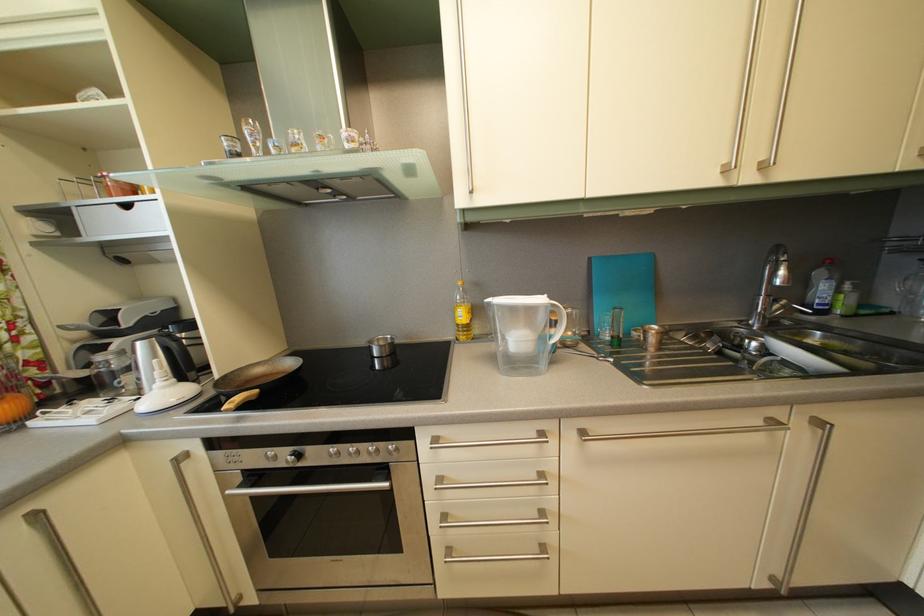
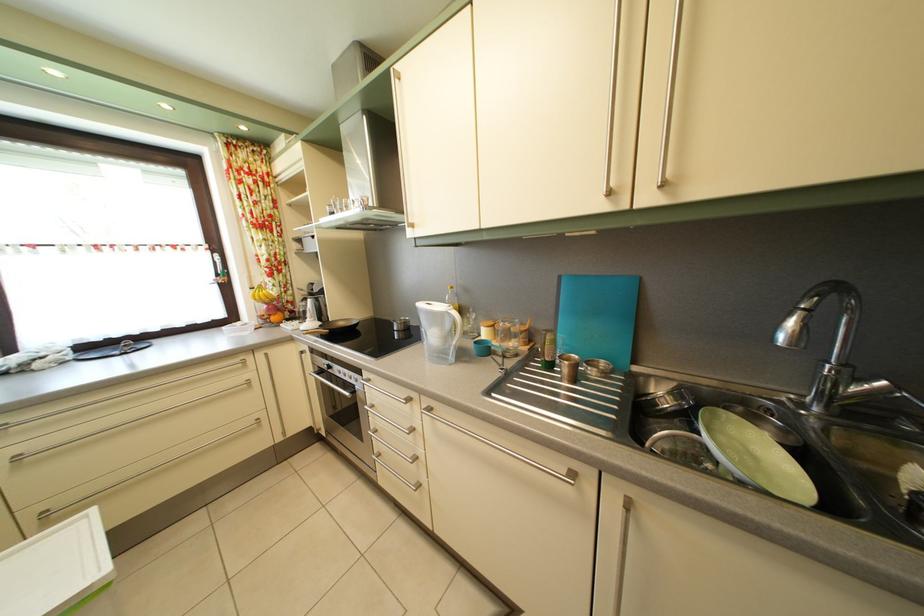
Find the pixel in the second image that matches the point at 792,309 in the first image.

(893, 391)